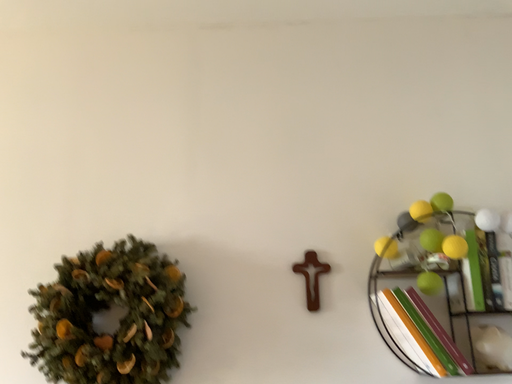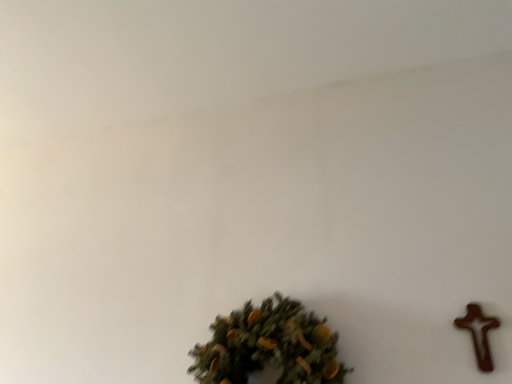
Question: Which way did the camera rotate in the video?

Choices:
 (A) rotated downward
 (B) rotated upward

Answer: (B)